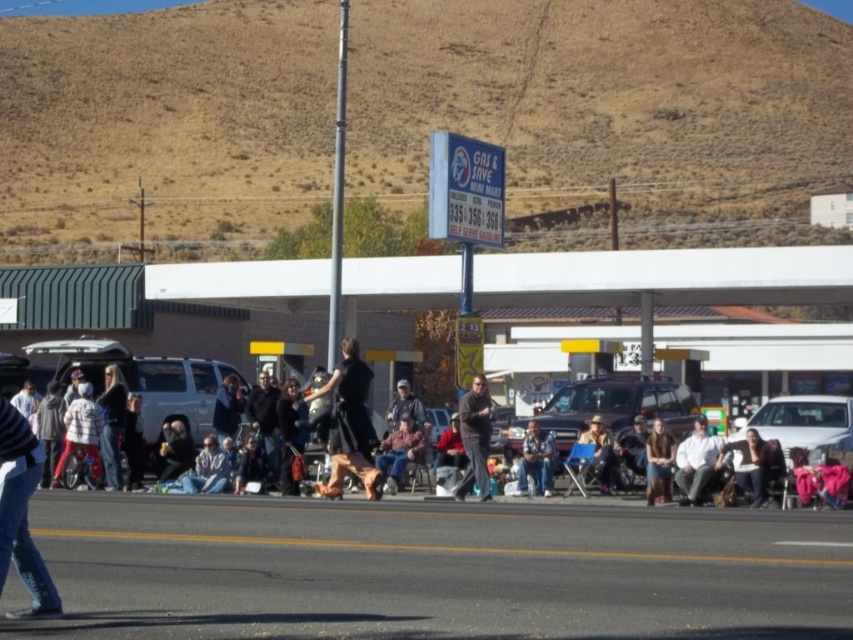
Question: Does dark gray sweater at center have a greater width compared to dark gray fabric jacket at center?

Choices:
 (A) yes
 (B) no

Answer: (A)

Question: Which point is closer to the camera?

Choices:
 (A) black fabric crowd at center
 (B) dark gray sweater at center

Answer: (B)

Question: Is the position of dark gray sweater at center more distant than that of dark gray fabric jacket at center?

Choices:
 (A) no
 (B) yes

Answer: (A)

Question: Which point appears farthest from the camera in this image?

Choices:
 (A) (206, 394)
 (B) (264, 396)
 (C) (469, 401)

Answer: (A)

Question: Does black fabric crowd at center have a larger size compared to dark gray fabric jacket at center?

Choices:
 (A) no
 (B) yes

Answer: (B)

Question: Which object is closer to the camera taking this photo?

Choices:
 (A) dark gray sweater at center
 (B) black fabric crowd at center

Answer: (A)